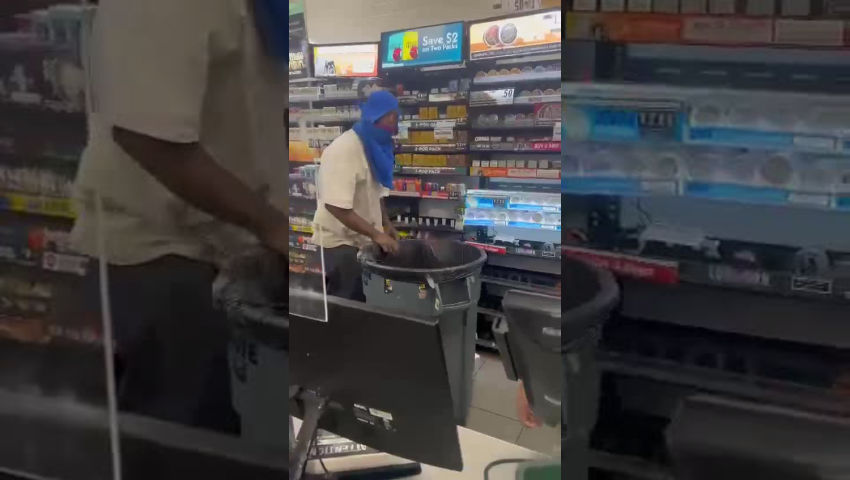
The height and width of the screenshot is (480, 850). Find the location of `window divider`. window divider is located at coordinates (308, 290), (85, 328).